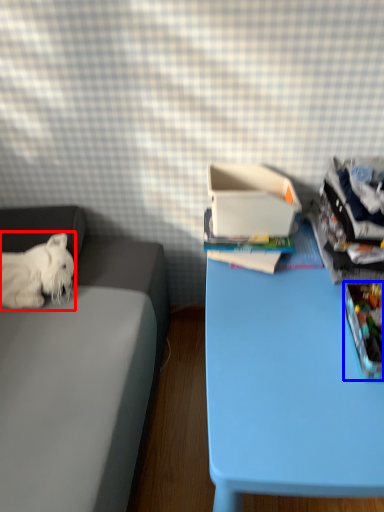
Question: Among these objects, which one is nearest to the camera, dog (highlighted by a red box) or storage box (highlighted by a blue box)?

Choices:
 (A) dog
 (B) storage box

Answer: (B)